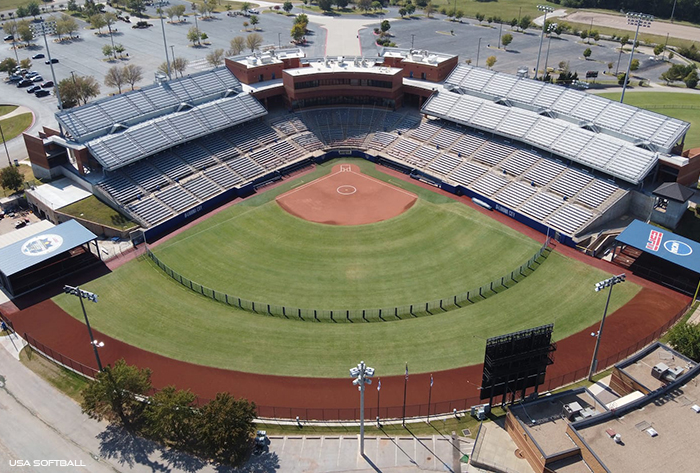
You are a GUI agent. You are given a task and a screenshot of the screen. Output one action in this format:
    pyautogui.click(x=<x>, y=<y>)
    Task: Click on the lights
    The width and height of the screenshot is (700, 473).
    Given the screenshot: What is the action you would take?
    pyautogui.click(x=547, y=14), pyautogui.click(x=642, y=23), pyautogui.click(x=160, y=4), pyautogui.click(x=42, y=35)